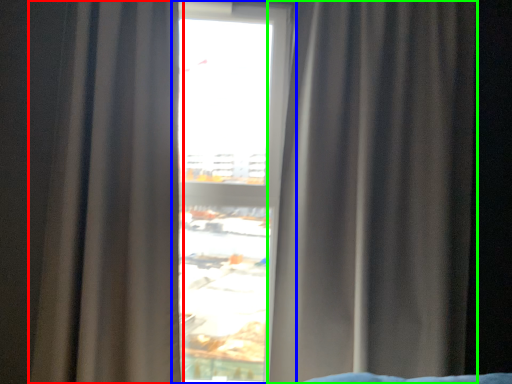
Question: Based on their relative distances, which object is nearer to curtain (highlighted by a red box)? Choose from window (highlighted by a blue box) and curtain (highlighted by a green box).

Choices:
 (A) window
 (B) curtain

Answer: (A)